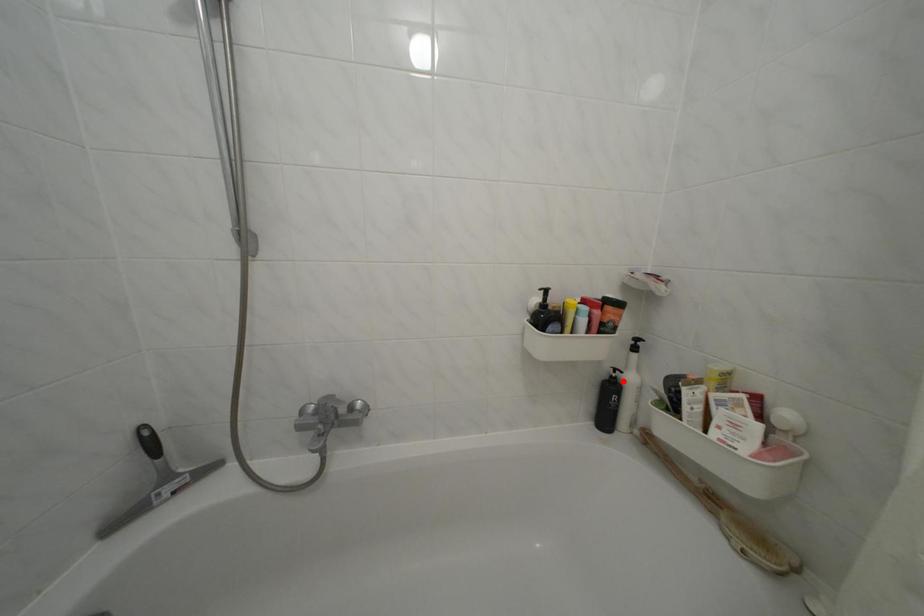
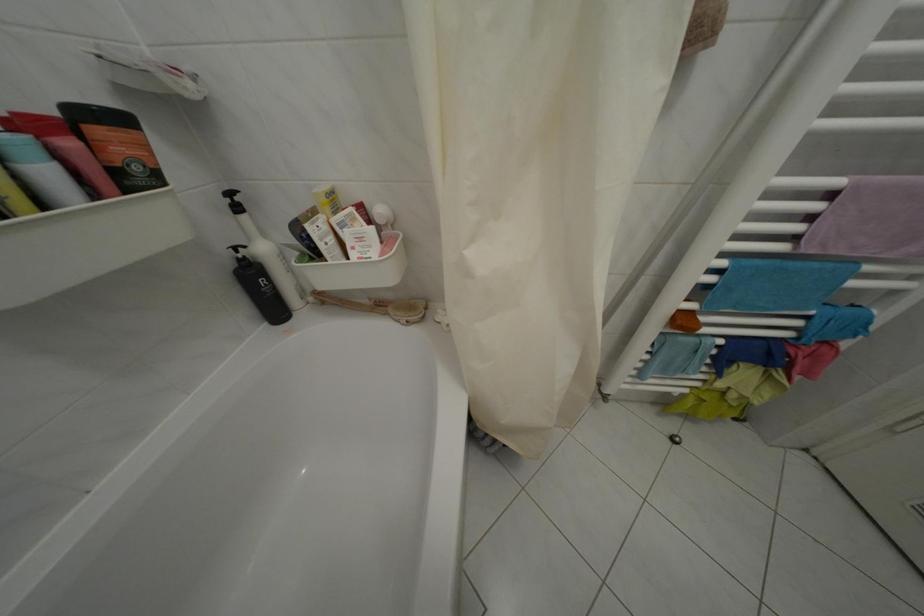
Question: I am providing you with two images of the same scene from different viewpoints. Given a red point in image1, look at the same physical point in image2. Is it:

Choices:
 (A) Closer to the viewpoint
 (B) Farther from the viewpoint

Answer: (A)